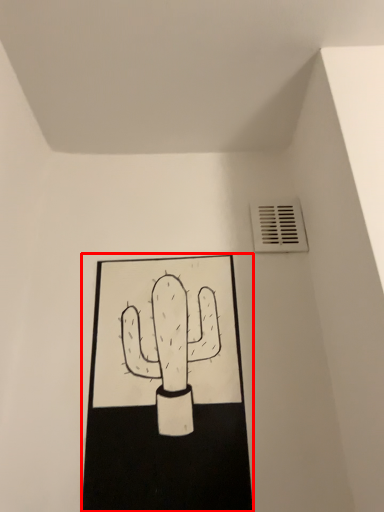
Question: Where is sketch (annotated by the red box) located in relation to air conditioning in the image?

Choices:
 (A) right
 (B) left

Answer: (B)